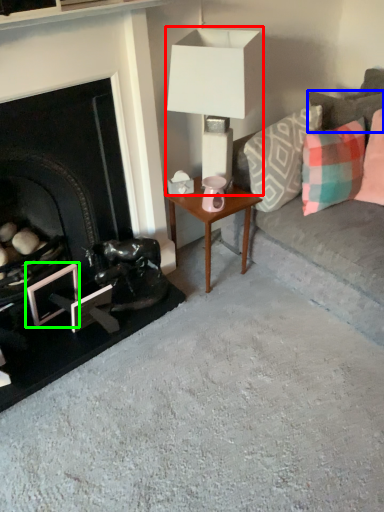
Question: Which object is the farthest from table lamp (highlighted by a red box)? Choose among these: pillow (highlighted by a blue box) or picture frame (highlighted by a green box).

Choices:
 (A) pillow
 (B) picture frame

Answer: (B)